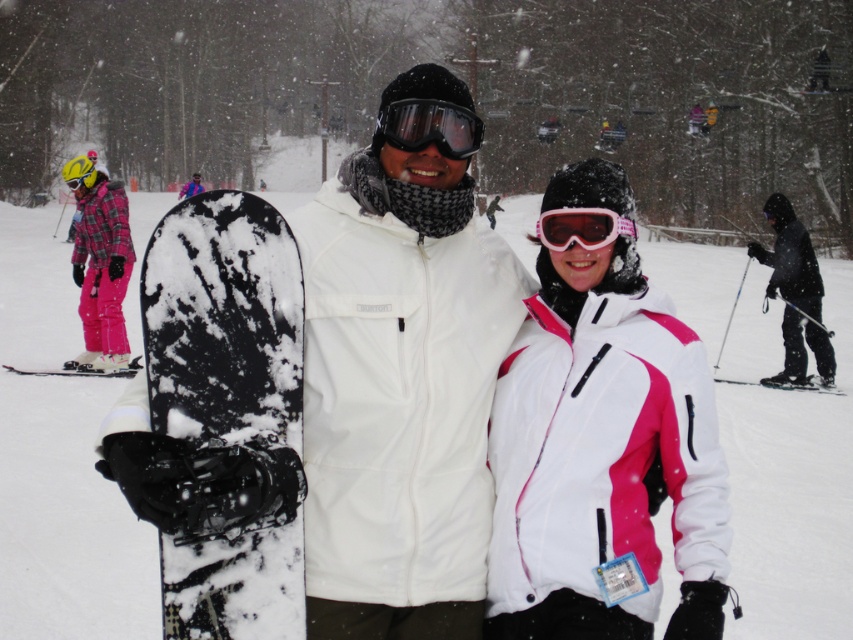
You are a photographer trying to capture a closeup shot of both the snowy matte snowboard at center and the pink matte goggles at center. Since you can only focus on one object at a time, which object should you choose to ensure the entire object fits within the camera frame without cropping?

The snowy matte snowboard at center is wider than the pink matte goggles at center, so you should focus on the snowy matte snowboard at center to ensure it fits within the camera frame without cropping, as it is the larger object.

Based on the photo, what object is located at the coordinates point (228, 413) in the image?

The snowy matte snowboard at center is located at point (228, 413).